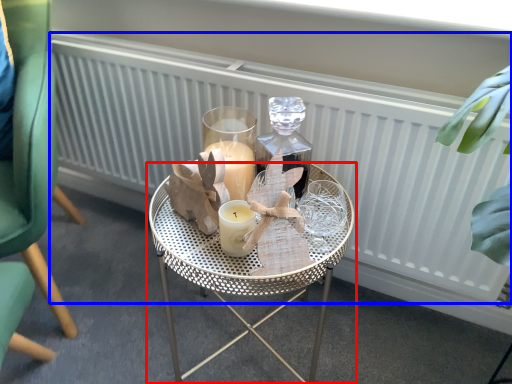
Question: Among these objects, which one is nearest to the camera, table (highlighted by a red box) or radiator (highlighted by a blue box)?

Choices:
 (A) table
 (B) radiator

Answer: (A)